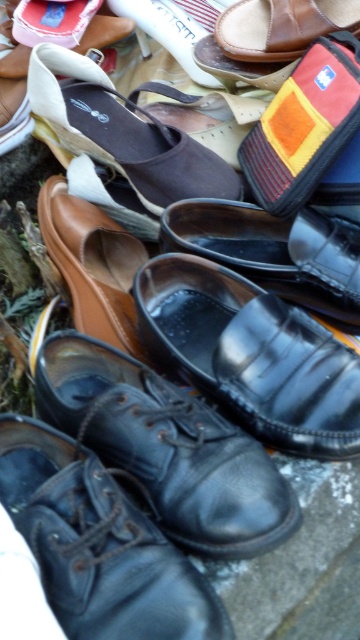
You are organizing a charity drive and need to sort shoes by their position. You have a black leather dress shoe at center and a brown fabric sandal at upper center. Which shoe is positioned higher on the image?

The brown fabric sandal at upper center is positioned higher in the image since it is located above the black leather dress shoe at center.

You are standing at the origin point of the image. Which direction should you move to reach the black leather dress shoe at lower left?

You should move towards the lower left direction to reach the black leather dress shoe at lower left.